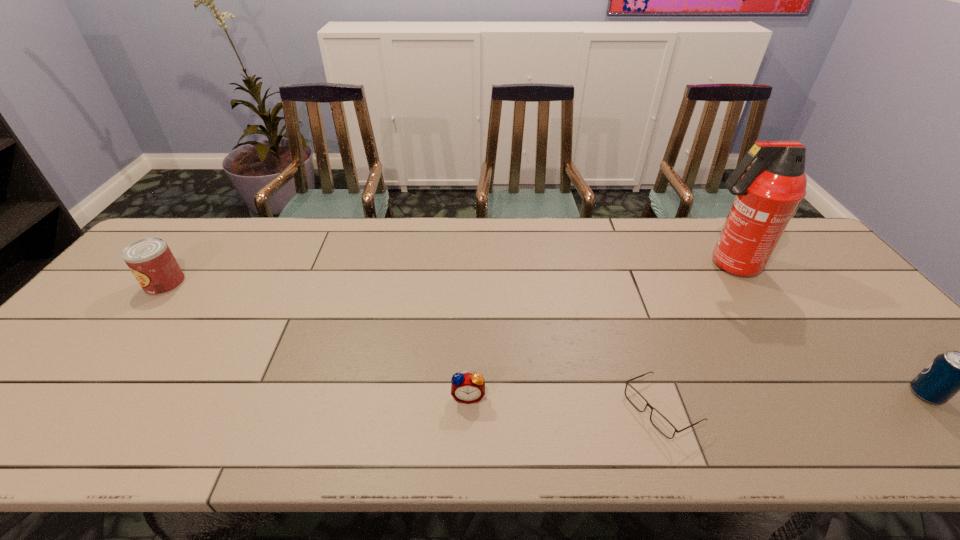
Find the location of a particular element. vacant area that lies between the can and the spectacles is located at coordinates (413, 346).

Where is `empty space that is in between the tallest object and the fourth object from right to left`? empty space that is in between the tallest object and the fourth object from right to left is located at coordinates (599, 330).

Locate an element on the screen. The width and height of the screenshot is (960, 540). free area in between the soda can and the third object from right to left is located at coordinates (793, 402).

Find the location of a particular element. The width and height of the screenshot is (960, 540). free space between the third object from left to right and the soda can is located at coordinates (793, 402).

Find the location of a particular element. vacant space that is in between the soda can and the third object from left to right is located at coordinates (793, 402).

You are a GUI agent. You are given a task and a screenshot of the screen. Output one action in this format:
    pyautogui.click(x=<x>, y=<y>)
    Task: Click on the empty space that is in between the third object from right to left and the tallest object
    
    Given the screenshot: What is the action you would take?
    pyautogui.click(x=695, y=337)

Select which object is the fourth closest to the second shortest object. Please provide its 2D coordinates. Your answer should be formatted as a tuple, i.e. [(x, y)], where the tuple contains the x and y coordinates of a point satisfying the conditions above.

[(950, 372)]

Identify the location of object that ranks as the fourth closest to the soda can. (151, 261).

The image size is (960, 540). I want to click on vacant space that satisfies the following two spatial constraints: 1. on the trigger side of the fourth object from left to right; 2. on the right side of the soda can, so click(815, 394).

Find the location of a particular element. The height and width of the screenshot is (540, 960). blank space that satisfies the following two spatial constraints: 1. on the trigger side of the soda can; 2. on the right side of the fire extinguisher is located at coordinates (815, 394).